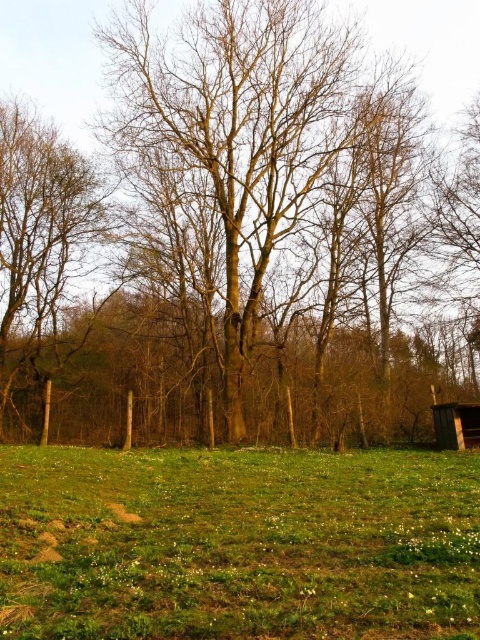
You are planning to place a picnic blanket in this outdoor scene. The picnic blanket is 2 meters wide. There are two trees in the image, the bare wood tree at center and the brown rough tree at left. Which tree should you position the blanket closer to if you want to ensure it doesn

The picnic blanket should be positioned closer to the bare wood tree at center because it is larger in size than the brown rough tree at left, providing more shade or space.